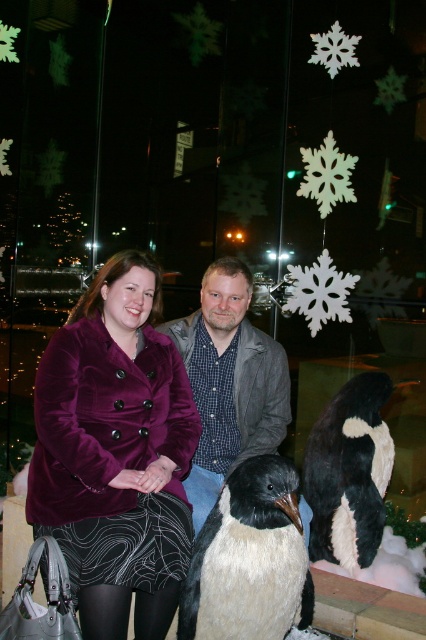
You are taking a photo of the velvet purple coat at center and want to ensure it is in focus. If your camera has a minimum focusing distance of 5 feet, will you need to adjust your position?

The velvet purple coat at center is 5.77 feet from the camera, which is beyond the minimum focusing distance of 5 feet. Therefore, you do not need to adjust your position.

You are a photographer trying to capture a closeup of the velvet purple coat at center and the white soft penguin at center. Since your camera can only focus on objects within 12 inches, will you need to adjust your position to get both in focus?

The velvet purple coat at center is 13.83 inches away from the white soft penguin at center. Since the distance between them is greater than 12 inches, you will need to adjust your position to ensure both are within the camera focus range.